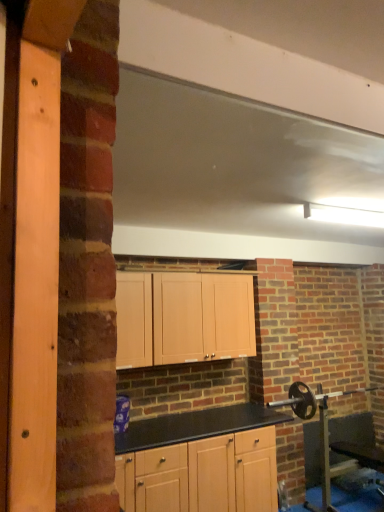
Find the location of a particular element. The image size is (384, 512). matte wood fireplace at center is located at coordinates (282, 342).

What do you see at coordinates (282, 342) in the screenshot? The width and height of the screenshot is (384, 512). I see `matte wood fireplace at center` at bounding box center [282, 342].

You are a GUI agent. You are given a task and a screenshot of the screen. Output one action in this format:
    pyautogui.click(x=<x>, y=<y>)
    Task: Click on the matte wood fireplace at center
    This screenshot has height=512, width=384.
    Given the screenshot: What is the action you would take?
    pyautogui.click(x=282, y=342)